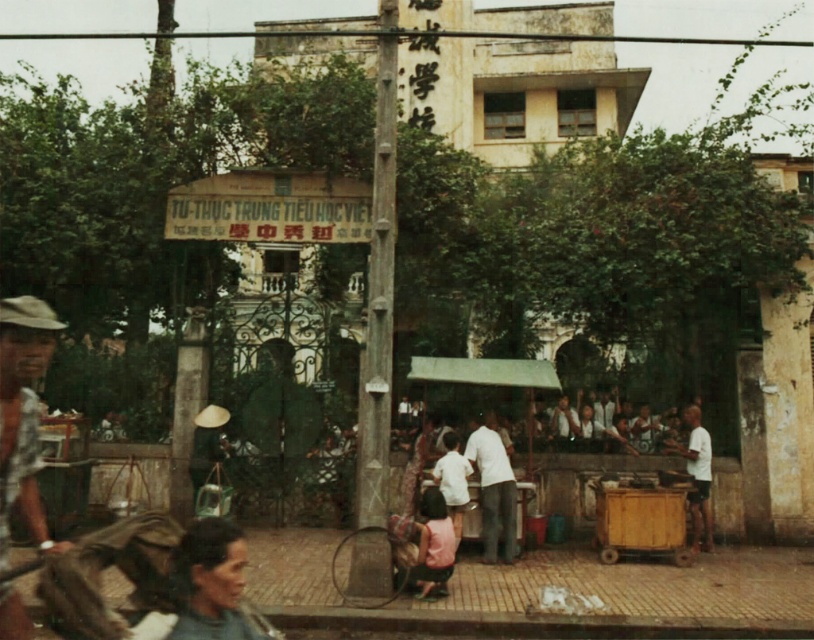
You are a photographer standing at the vendor stall with a green canopy. You want to take a photo of both the white matte shirt at center and the white matte shirt at lower right in the same frame. Your camera has a maximum focus range of 6 meters. Can you capture both subjects in focus without moving your position?

The distance between the white matte shirt at center and the white matte shirt at lower right is 6.49 meters. Since the camera can only focus up to 6 meters, it cannot capture both subjects in focus simultaneously without moving your position.

You are a photographer standing at the center of the street scene. You notice a plaid fabric shirt at left. Where exactly is the plaid fabric shirt located in the scene?

The plaid fabric shirt at left is located at point 0.648 on the x axis and 0.028 on the y axis.

You are standing at the street vendor stall with a green canopy in the bustling Southeast Asian urban area. You see two points marked in the scene. Which point is closer to you, point (25, 506) or point (701, 476)?

Point (25, 506) is in front of point (701, 476), so it is closer to you.